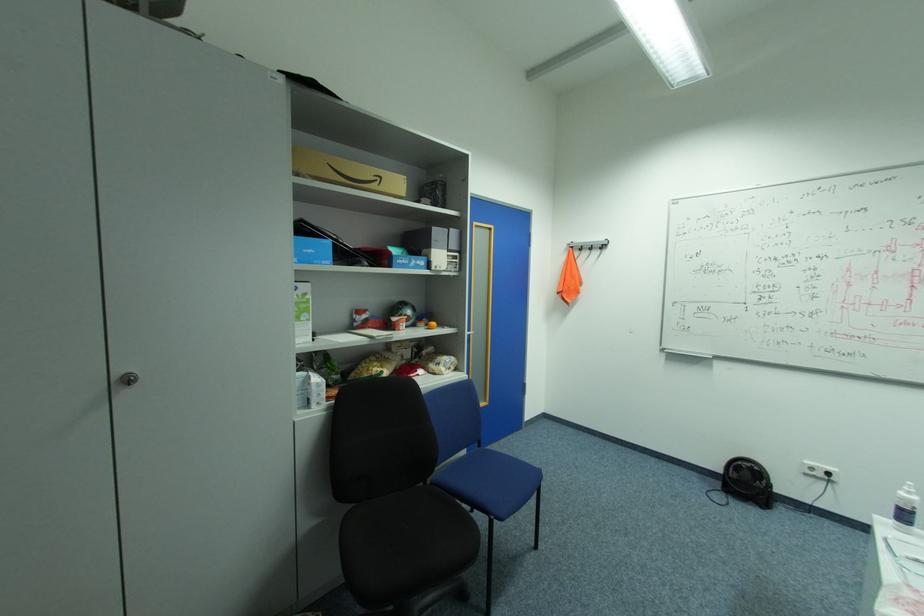
At what (x,y) coordinates should I click in order to perform the action: click on black floor fan. Please return your answer as a coordinate pair (x, y). The image size is (924, 616). Looking at the image, I should click on (747, 480).